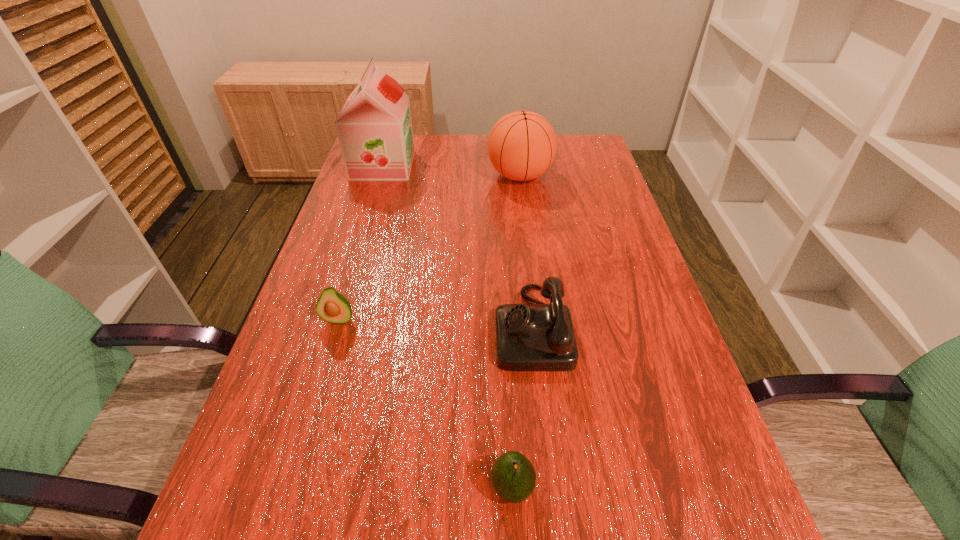
Image resolution: width=960 pixels, height=540 pixels. I want to click on vacant space located 0.100m on the dial of the telephone, so click(447, 327).

The width and height of the screenshot is (960, 540). What are the coordinates of `vacant space located 0.050m on the cut side of the left avocado` in the screenshot? It's located at (330, 347).

Identify the location of vacant area located on the left of the nearest object. (252, 488).

Where is `soya milk that is at the far edge`? The width and height of the screenshot is (960, 540). soya milk that is at the far edge is located at coordinates (374, 127).

You are a GUI agent. You are given a task and a screenshot of the screen. Output one action in this format:
    pyautogui.click(x=<x>, y=<y>)
    Task: Click on the basketball that is positioned at the far edge
    
    Given the screenshot: What is the action you would take?
    pyautogui.click(x=522, y=145)

Find the location of `soya milk situated at the left edge`. soya milk situated at the left edge is located at coordinates coord(374,127).

Image resolution: width=960 pixels, height=540 pixels. In order to click on avocado present at the left edge in this screenshot , I will do `click(332, 306)`.

Identify the location of object located in the far left corner section of the desktop. (374, 127).

Find the location of `free spot at the left edge of the desktop`. free spot at the left edge of the desktop is located at coordinates (358, 222).

Identify the location of free space at the right edge of the desktop. The width and height of the screenshot is (960, 540). (554, 174).